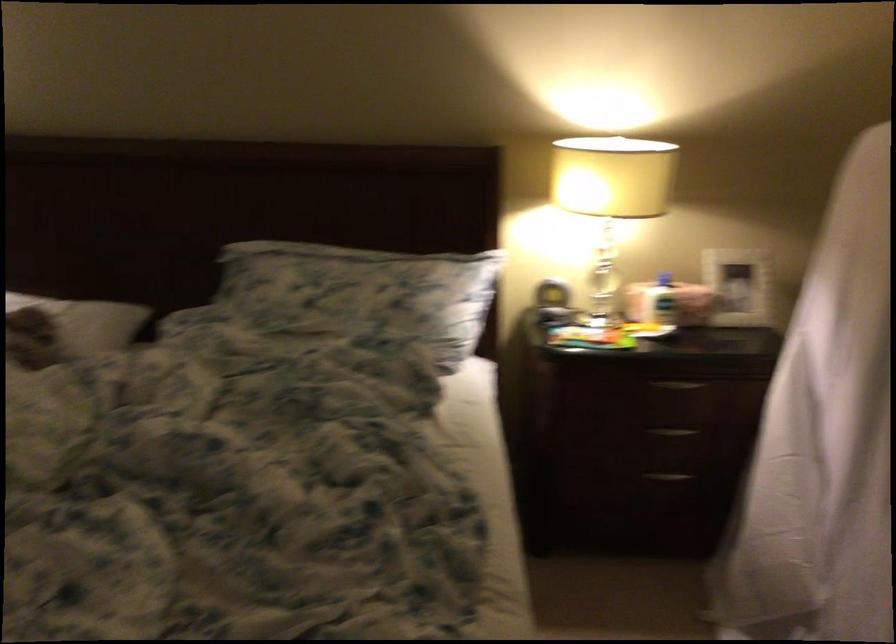
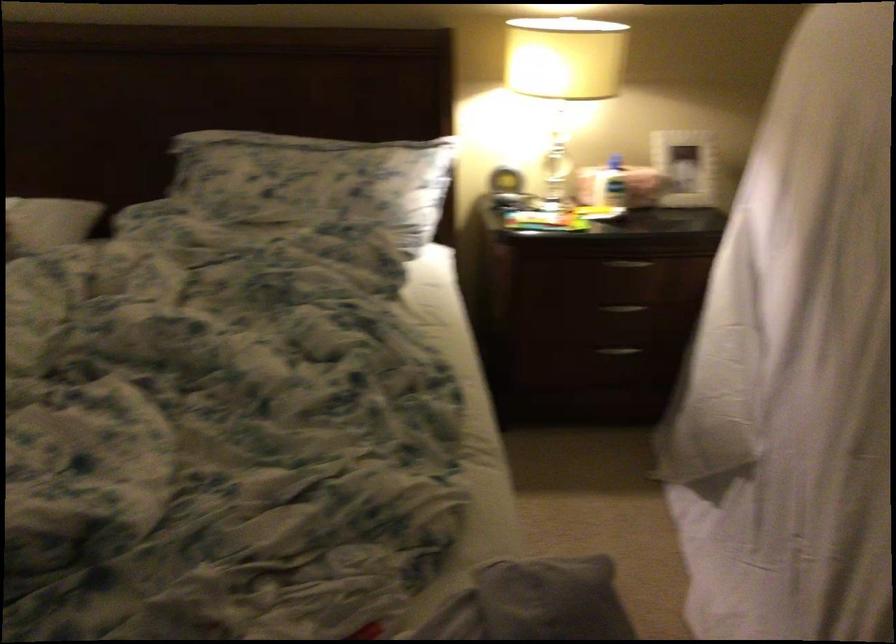
Locate, in the second image, the point that corresponds to pixel 741 287 in the first image.

(684, 167)